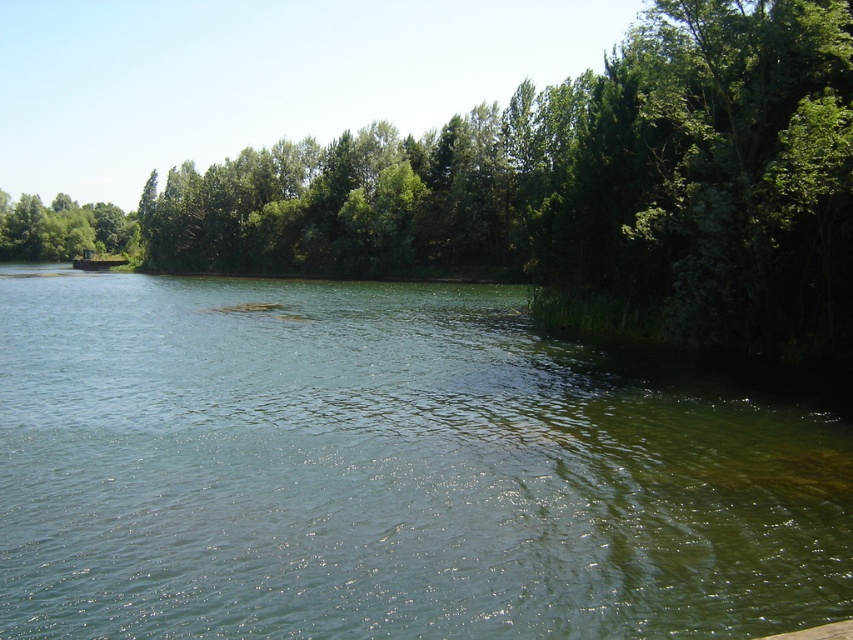
You are standing at the riverside and want to cross to the opposite bank. You notice the green translucent water at center. Based on its location, is this area safe to walk through?

The green translucent water at center is located at point [386,472], which might indicate a shallower or calmer part of the river, potentially safer for crossing. However, without additional depth information, caution is advised.

You are standing on the riverside and want to cross to the other side. You see the green translucent water at center and the green leafy tree at center. Which one is wider from your perspective?

The green leafy tree at center is wider than the green translucent water at center.

You are a hiker planning to cross the river using a narrow path that runs along the riverbank. The path is exactly 160 meters long. You see the green translucent water at center and the green leafy tree at left. Can you determine if the path between them is long enough for your planned route?

The path between the green translucent water at center and the green leafy tree at left is 164.55 meters, which is longer than the 160 meters path available. Therefore, the path is not long enough for your planned route.